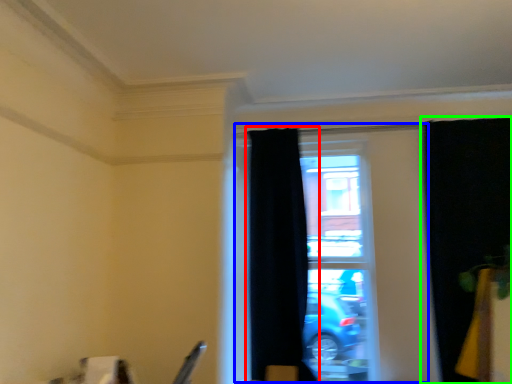
Question: Which is nearer to the curtain (highlighted by a red box)? window (highlighted by a blue box) or curtain (highlighted by a green box).

Choices:
 (A) window
 (B) curtain

Answer: (A)